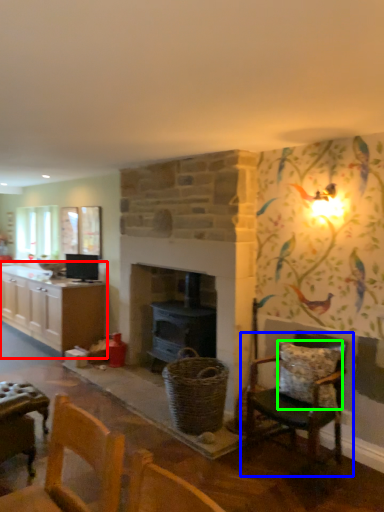
Question: Which object is positioned closest to cabinetry (highlighted by a red box)? Select from chair (highlighted by a blue box) and pillow (highlighted by a green box).

Choices:
 (A) chair
 (B) pillow

Answer: (A)